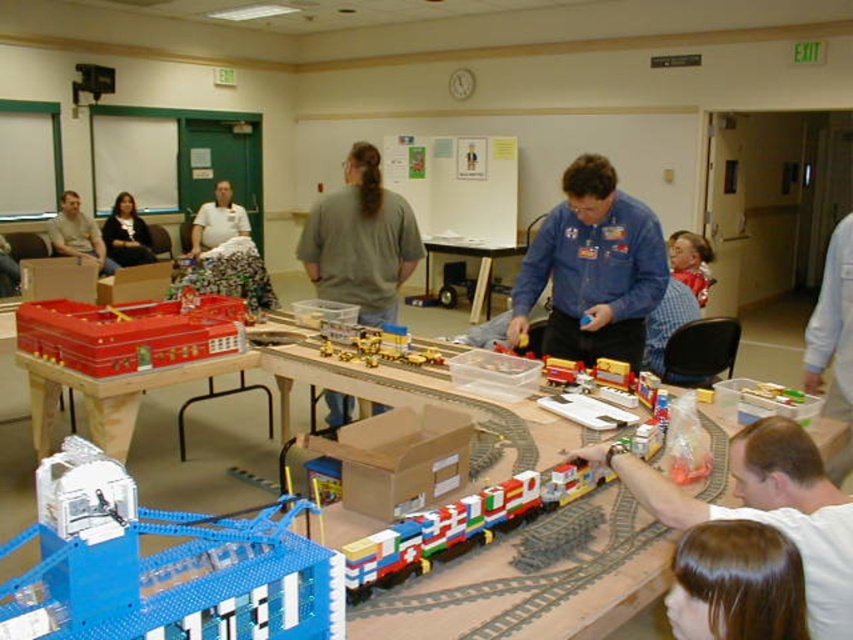
Measure the distance from shiny plastic train car at left to light brown hair at upper right.

A distance of 3.15 meters exists between shiny plastic train car at left and light brown hair at upper right.

Is point (32, 324) positioned after point (700, 284)?

No, it is in front of (700, 284).

Identify the location of shiny plastic train car at left. Image resolution: width=853 pixels, height=640 pixels. (131, 332).

Which is in front, point (308, 636) or point (177, 272)?

Point (308, 636) is in front.

Is blue plastic bridge at lower left shorter than floral skirt at center?

Correct, blue plastic bridge at lower left is not as tall as floral skirt at center.

Is point (128, 621) more distant than point (247, 266)?

No, it is not.

Identify the location of blue plastic bridge at lower left. This screenshot has width=853, height=640. (163, 566).

Can you confirm if blue denim shirt at center is positioned to the left of wooden table at center?

No, blue denim shirt at center is not to the left of wooden table at center.

Describe the element at coordinates (592, 268) in the screenshot. I see `blue denim shirt at center` at that location.

Who is more forward, (518, 310) or (457, 246)?

Point (518, 310)

Find the location of `blue denim shirt at center`. blue denim shirt at center is located at coordinates (592, 268).